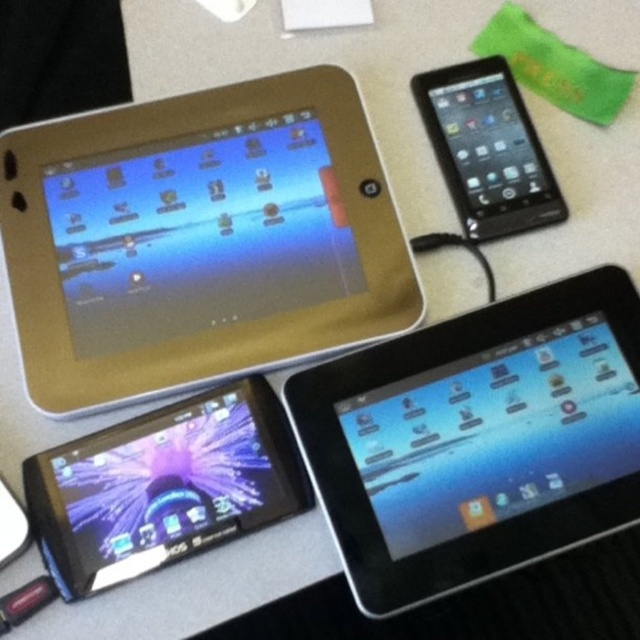
A photographer wants to take a picture of the point at coordinates (502,538) and the camera. Which one is closer to the camera?

The point at coordinates (502,538) is 68.55 centimeters away from the camera, so the camera is closer to itself than the point.